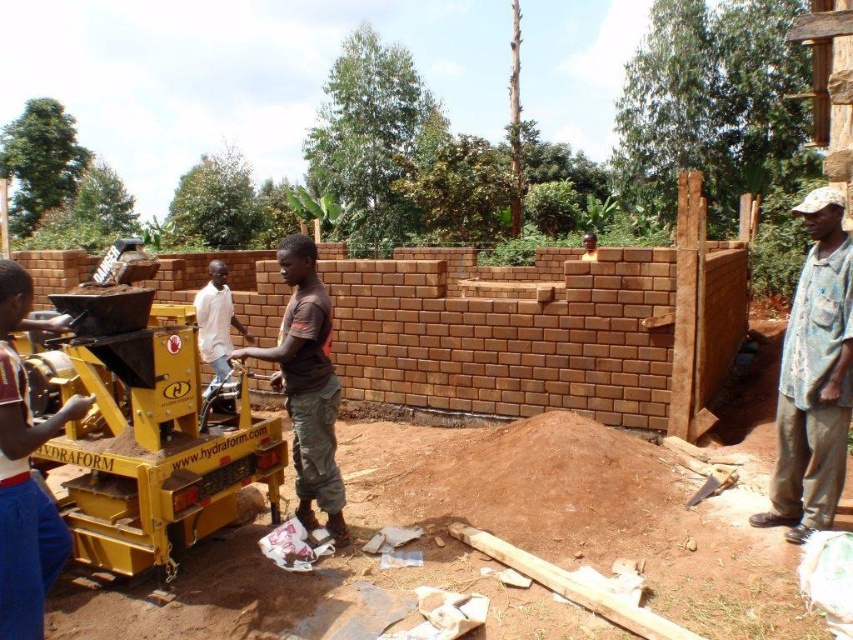
Can you confirm if matte yellow machine at center is shorter than white matte shirt at center?

No, matte yellow machine at center is not shorter than white matte shirt at center.

You are a GUI agent. You are given a task and a screenshot of the screen. Output one action in this format:
    pyautogui.click(x=<x>, y=<y>)
    Task: Click on the matte yellow machine at center
    
    Given the screenshot: What is the action you would take?
    pyautogui.click(x=25, y=474)

Does point (3, 532) come in front of point (219, 349)?

Yes.

Locate an element on the screen. matte yellow machine at center is located at coordinates (25, 474).

Does denim shirt at right have a smaller size compared to brown matte shirt at center?

Yes.

Who is more distant from viewer, (831, 436) or (291, 397)?

The point (291, 397) is more distant.

The height and width of the screenshot is (640, 853). In order to click on denim shirt at right in this screenshot , I will do `click(814, 378)`.

Between denim shirt at right and matte yellow machine at center, which one appears on the right side from the viewer's perspective?

denim shirt at right is more to the right.

Does denim shirt at right have a smaller size compared to matte yellow machine at center?

Yes.

Is point (804, 220) farther from camera compared to point (24, 529)?

Yes.

Locate an element on the screen. Image resolution: width=853 pixels, height=640 pixels. denim shirt at right is located at coordinates (814, 378).